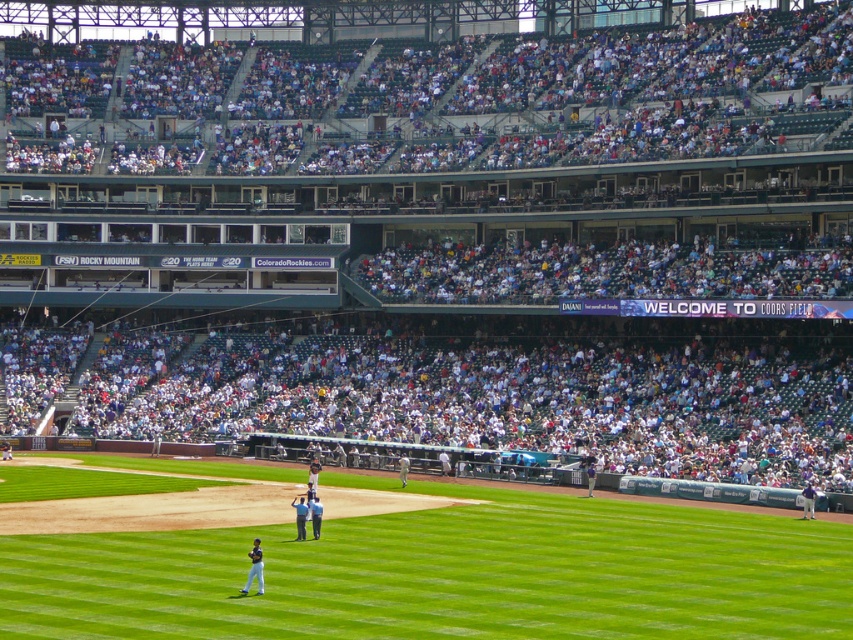
You are a player standing at point (302, 512) in the baseball field. You want to throw the ball to a teammate located at point (256, 538). Is the teammate in front of or behind you relative to your position?

The teammate at point (256, 538) is behind you because point (256, 538) is behind point (302, 512).

You are a photographer at Coors Field and want to capture a photo of both the dark blue uniform at lower left and the blue uniformed man at center without any obstructions. Based on their positions, which player should you focus on first to ensure the other is visible behind them?

The dark blue uniform at lower left is in front of the blue uniformed man at center, so you should focus on the dark blue uniform at lower left first to ensure the blue uniformed man at center is visible behind them.

You are a photographer at Coors Field and want to capture a shot that includes both the green grass at center and the dark blue uniform at lower left. Based on their positions, which object should you focus on first to ensure both are in frame?

The green grass at center is located above the dark blue uniform at lower left, so you should focus on the dark blue uniform at lower left first to ensure both are in frame.